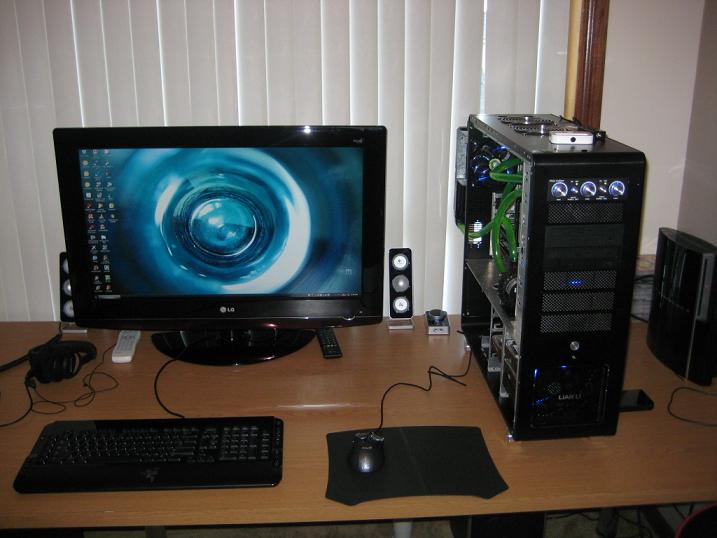
The height and width of the screenshot is (538, 717). In order to click on monitor in this screenshot , I will do `click(265, 269)`.